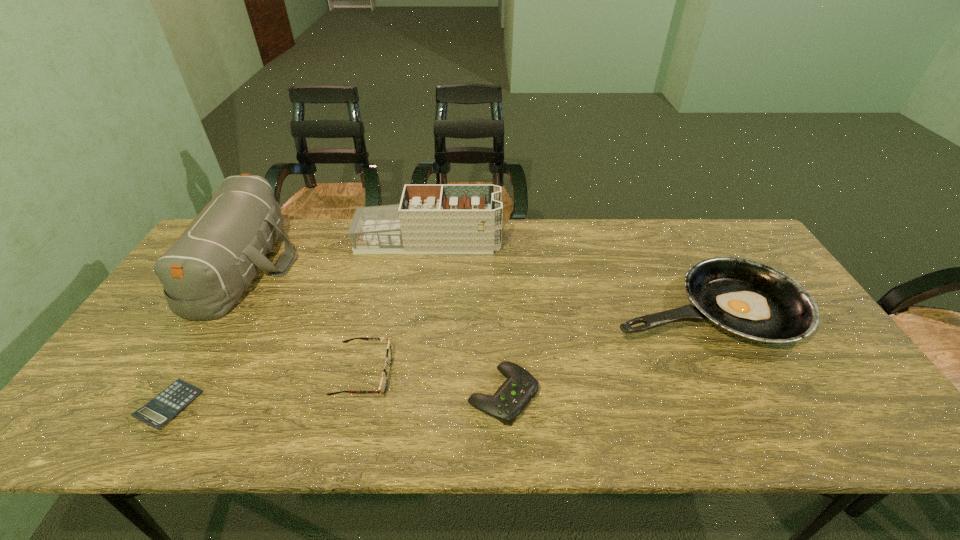
This screenshot has height=540, width=960. I want to click on free space located 0.220m on the frame of the spectacles, so click(x=481, y=374).

Image resolution: width=960 pixels, height=540 pixels. In order to click on vacant region located 0.310m on the right of the second shortest object in this screenshot , I will do point(671,395).

Locate an element on the screen. The image size is (960, 540). vacant space located 0.370m on the right of the shortest object is located at coordinates (358, 405).

The image size is (960, 540). I want to click on duffel bag that is at the far edge, so click(204, 273).

The width and height of the screenshot is (960, 540). I want to click on dollhouse at the far edge, so click(x=431, y=218).

At what (x,y) coordinates should I click in order to perform the action: click on control at the near edge. Please return your answer as a coordinate pair (x, y). This screenshot has width=960, height=540. Looking at the image, I should click on (512, 397).

The height and width of the screenshot is (540, 960). What are the coordinates of `calculator that is at the near edge` in the screenshot? It's located at (165, 406).

The width and height of the screenshot is (960, 540). What are the coordinates of `duffel bag that is at the left edge` in the screenshot? It's located at (204, 273).

At what (x,y) coordinates should I click in order to perform the action: click on calculator that is at the left edge. Please return your answer as a coordinate pair (x, y). The width and height of the screenshot is (960, 540). Looking at the image, I should click on (165, 406).

This screenshot has width=960, height=540. Identify the location of object at the right edge. (747, 299).